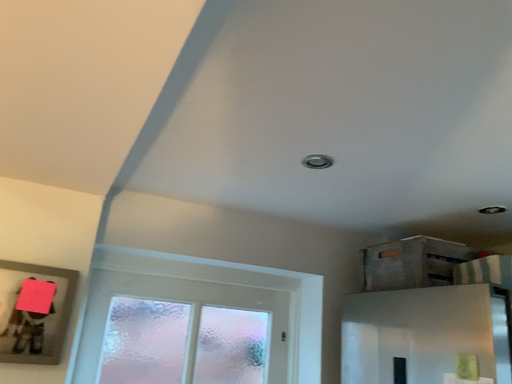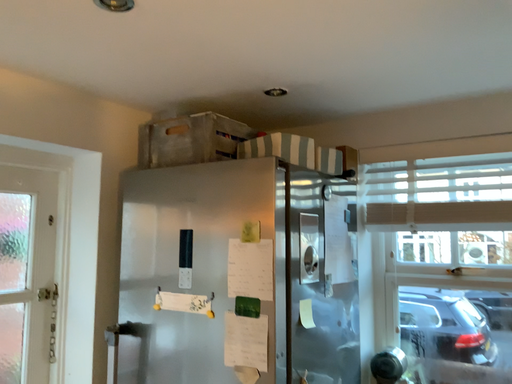
Question: How did the camera likely rotate when shooting the video?

Choices:
 (A) rotated right
 (B) rotated left

Answer: (A)